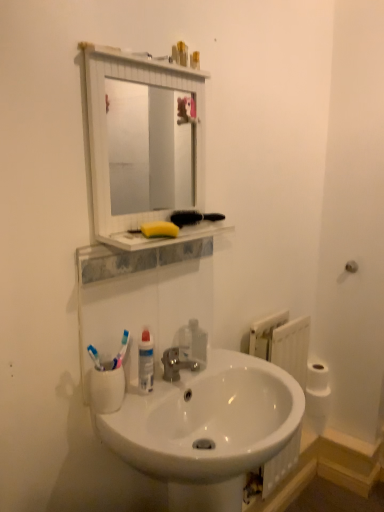
What are the coordinates of `vacant area in front of silver metallic faucet at center` in the screenshot? It's located at (151, 409).